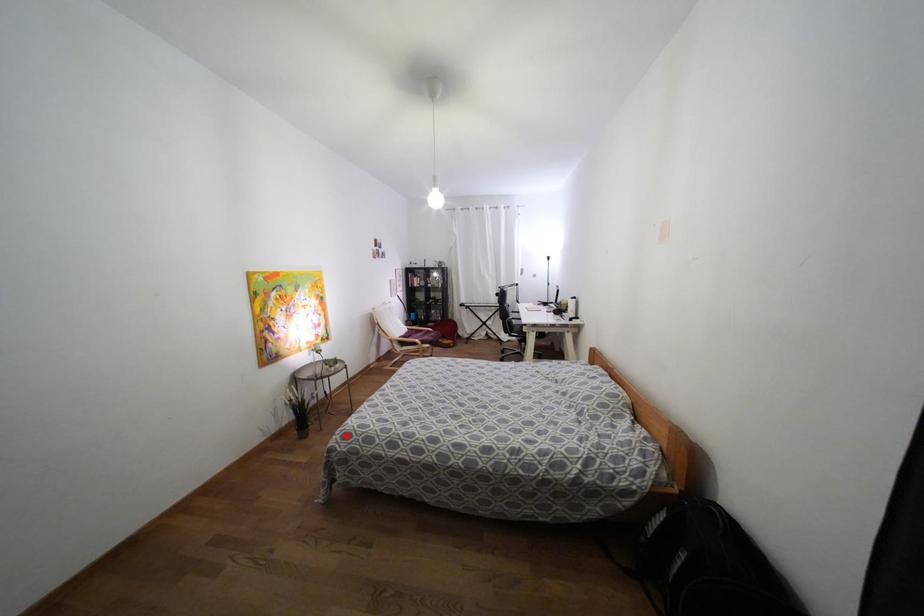
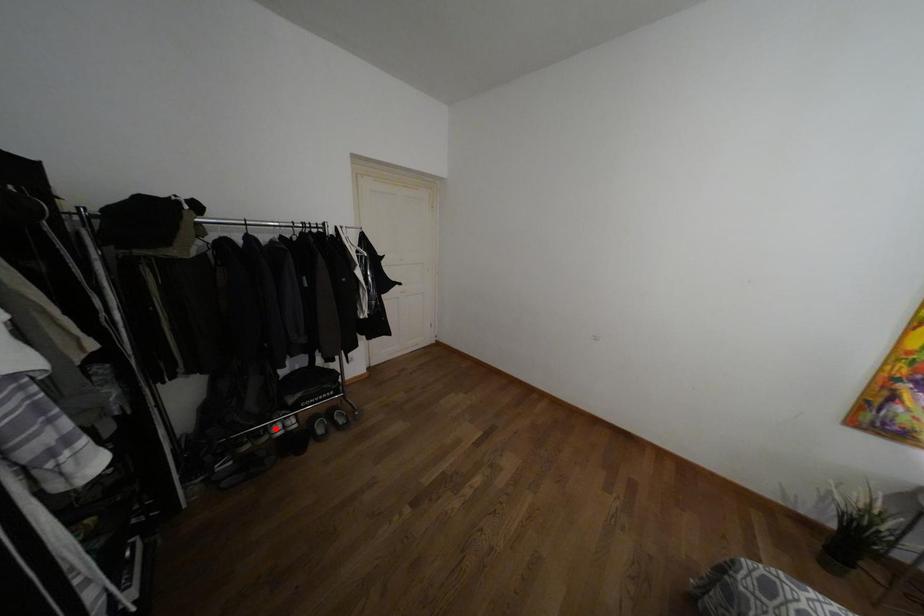
I am providing you with two images of the same scene from different viewpoints. A red point is marked on the first image and another point is marked on the second image. Are the points marked in image1 and image2 representing the same 3D position?

No